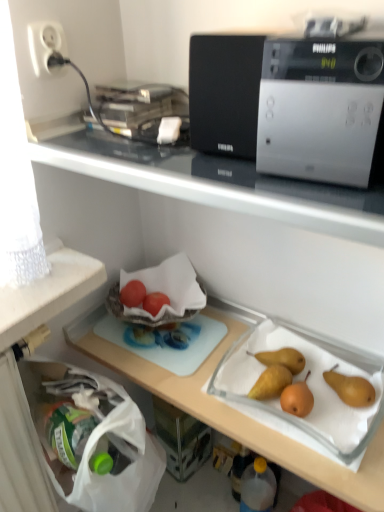
Question: From a real-world perspective, does matte red tomato at center-left, the 1th fruit positioned from the left, sit lower than transparent plastic bottle at lower center?

Choices:
 (A) no
 (B) yes

Answer: (A)

Question: Can you confirm if matte red tomato at center-left, the 1th fruit positioned from the left, is positioned to the right of transparent plastic bottle at lower center?

Choices:
 (A) yes
 (B) no

Answer: (B)

Question: Is matte red tomato at center-left, the 2th fruit from the right, positioned with its back to transparent plastic bottle at lower center?

Choices:
 (A) yes
 (B) no

Answer: (B)

Question: Is matte red tomato at center-left, the 1th fruit positioned from the left, aimed at transparent plastic bottle at lower center?

Choices:
 (A) yes
 (B) no

Answer: (B)

Question: Can you confirm if matte red tomato at center-left, the 1th fruit positioned from the left, is wider than transparent plastic bottle at lower center?

Choices:
 (A) yes
 (B) no

Answer: (B)

Question: Is matte red tomato at center-left, the 1th fruit positioned from the left, outside transparent plastic bottle at lower center?

Choices:
 (A) yes
 (B) no

Answer: (A)

Question: Does matte red tomato at center, which is counted as the 2th fruit, starting from the left, appear on the right side of transparent plastic bottle at lower center?

Choices:
 (A) yes
 (B) no

Answer: (B)

Question: Is matte red tomato at center, which is counted as the 2th fruit, starting from the left, oriented away from transparent plastic bottle at lower center?

Choices:
 (A) no
 (B) yes

Answer: (A)

Question: Can you confirm if matte red tomato at center, the first fruit when ordered from right to left, is shorter than transparent plastic bottle at lower center?

Choices:
 (A) no
 (B) yes

Answer: (B)

Question: From the image's perspective, is matte red tomato at center, which is counted as the 2th fruit, starting from the left, located above transparent plastic bottle at lower center?

Choices:
 (A) yes
 (B) no

Answer: (A)

Question: From a real-world perspective, is matte red tomato at center, which is counted as the 2th fruit, starting from the left, under transparent plastic bottle at lower center?

Choices:
 (A) yes
 (B) no

Answer: (B)

Question: Considering the relative sizes of matte red tomato at center, which is counted as the 2th fruit, starting from the left, and transparent plastic bottle at lower center in the image provided, is matte red tomato at center, which is counted as the 2th fruit, starting from the left, wider than transparent plastic bottle at lower center?

Choices:
 (A) yes
 (B) no

Answer: (B)

Question: Considering the relative sizes of silver metallic microwave at upper center and matte red tomato at center-left, the 2th fruit from the right, in the image provided, is silver metallic microwave at upper center shorter than matte red tomato at center-left, the 2th fruit from the right,?

Choices:
 (A) yes
 (B) no

Answer: (B)